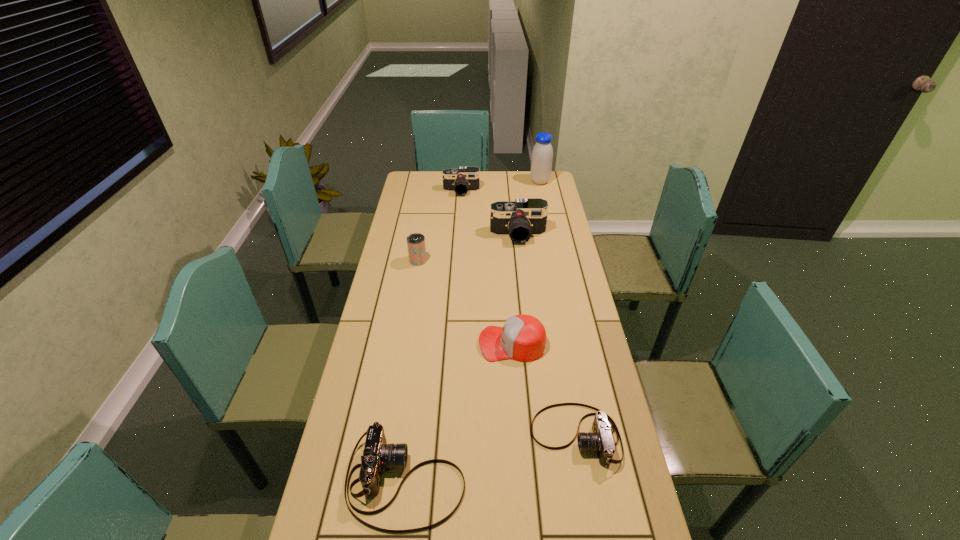
The width and height of the screenshot is (960, 540). Find the location of `free space between the right brown camera and the baseball cap`. free space between the right brown camera and the baseball cap is located at coordinates (543, 390).

In order to click on free space between the smaller black camera and the third nearest object in this screenshot , I will do `click(487, 267)`.

Identify the location of the fourth closest object to the left brown camera. (525, 217).

Identify the location of object that is the closest to the nearer black camera. The height and width of the screenshot is (540, 960). click(465, 179).

Identify the location of the closest camera to the bigger black camera. (465, 179).

Identify which camera is the fourth closest to the red baseball cap. Please provide its 2D coordinates. Your answer should be formatted as a tuple, i.e. [(x, y)], where the tuple contains the x and y coordinates of a point satisfying the conditions above.

[(465, 179)]

Identify the location of the closest brown camera to the fourth nearest object. (601, 440).

Locate which brown camera is the closest to the left black camera. Please provide its 2D coordinates. Your answer should be formatted as a tuple, i.e. [(x, y)], where the tuple contains the x and y coordinates of a point satisfying the conditions above.

[(601, 440)]